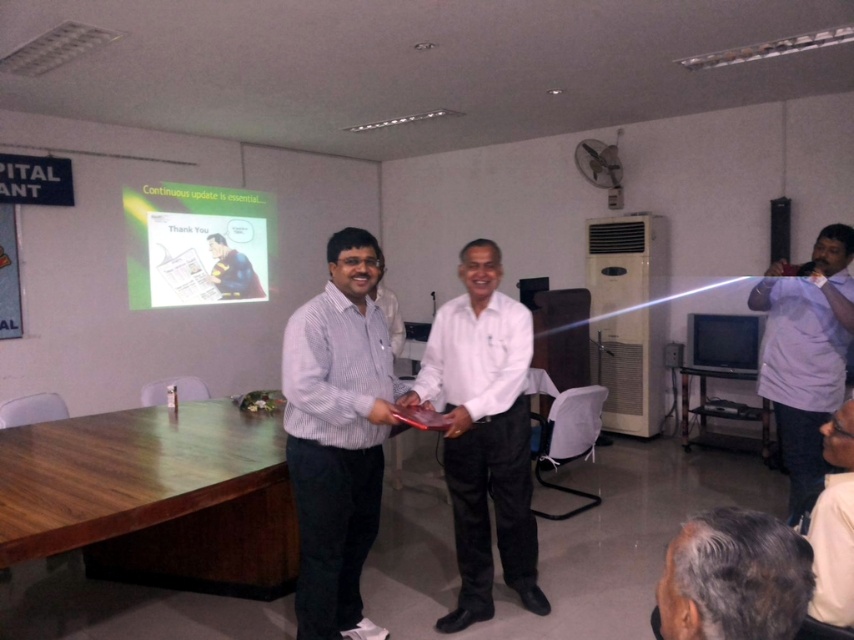
Between light blue shirt at right and white shirt at center, which one is positioned lower?

Positioned lower is white shirt at center.

Between light blue shirt at right and white shirt at center, which one is positioned higher?

light blue shirt at right is higher up.

Is point (820, 381) farther from camera compared to point (820, 529)?

Yes, it is.

Identify the location of light blue shirt at right. The image size is (854, 640). (805, 355).

From the picture: Between white glossy shirt at center and metallic silver table at center, which one appears on the right side from the viewer's perspective?

Positioned to the right is metallic silver table at center.

Does point (459, 404) come behind point (700, 429)?

No.

What are the coordinates of `white glossy shirt at center` in the screenshot? It's located at (483, 433).

Is white shirt at center shorter than metallic silver table at center?

Yes.

The height and width of the screenshot is (640, 854). Find the location of `white shirt at center`. white shirt at center is located at coordinates (834, 528).